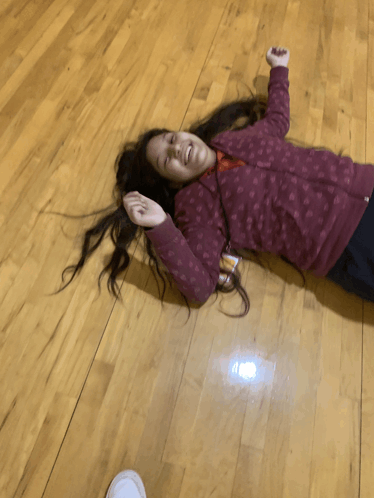
Identify the location of light. (243, 372).